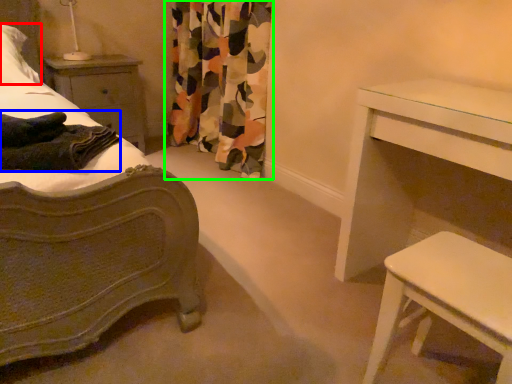
Question: Based on their relative distances, which object is nearer to pillow (highlighted by a red box)? Choose from blanket (highlighted by a blue box) and curtain (highlighted by a green box).

Choices:
 (A) blanket
 (B) curtain

Answer: (A)